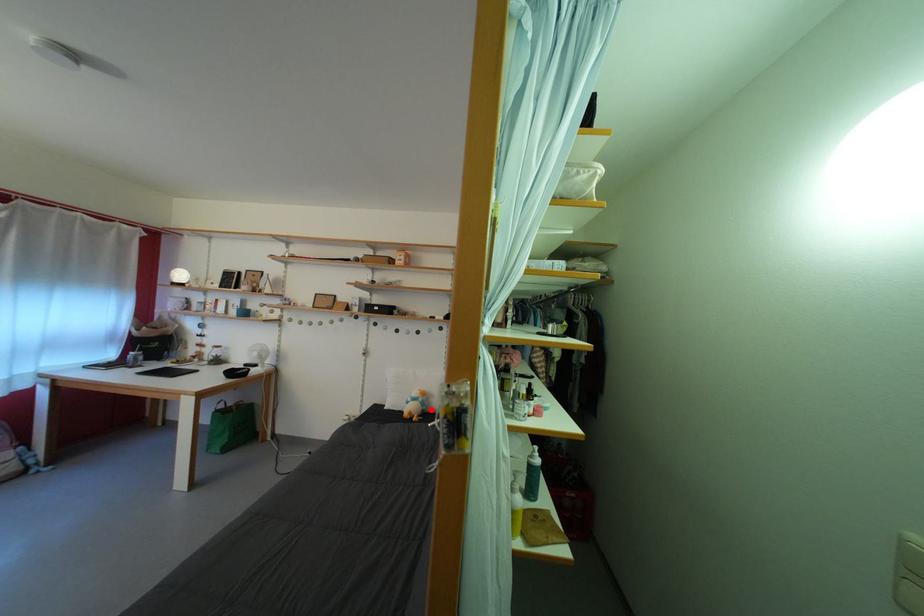
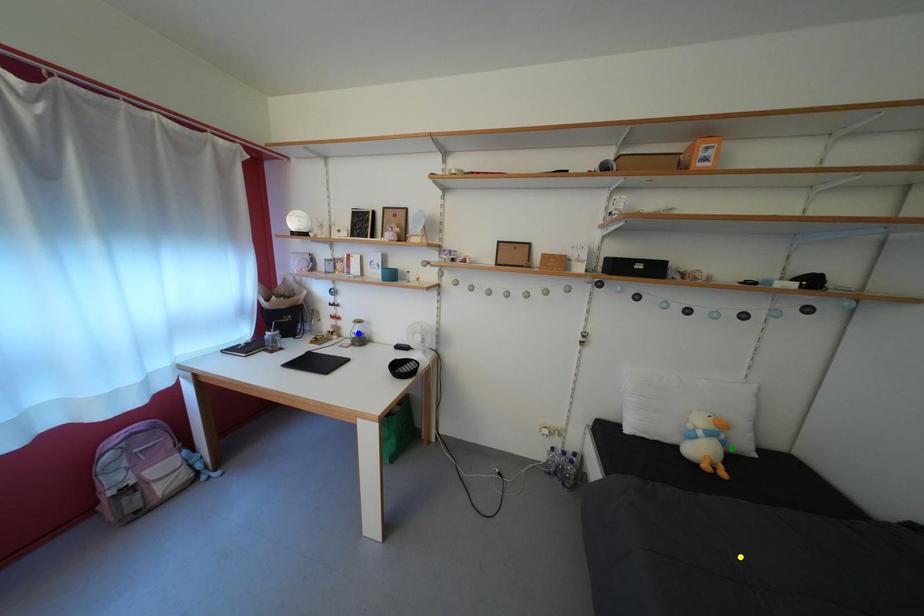
Question: I am providing you with two images of the same scene from different viewpoints. A red point is marked on the first image. You are given multiple points on the second image. Which spot in image 2 lines up with the point in image 1?

Choices:
 (A) blue point
 (B) yellow point
 (C) green point

Answer: (C)